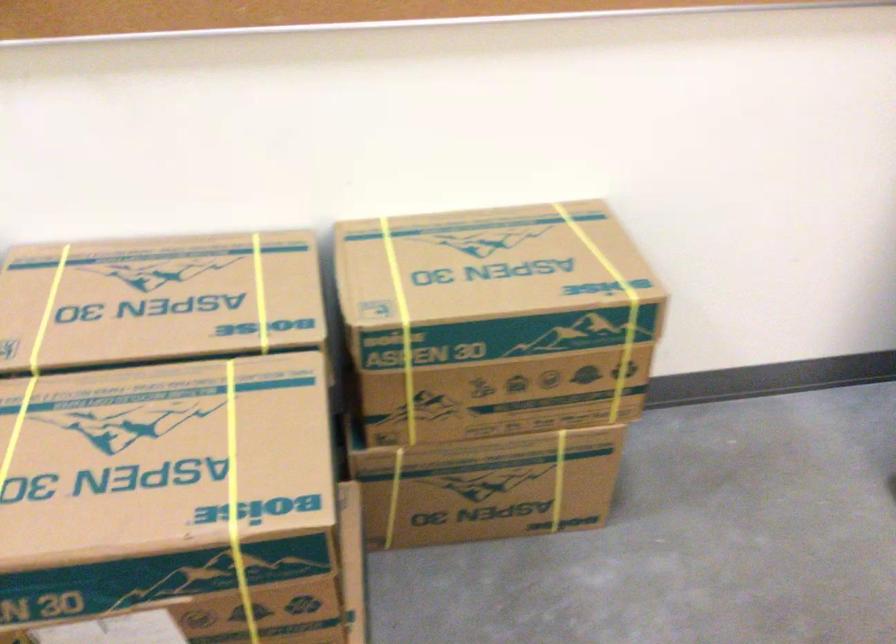
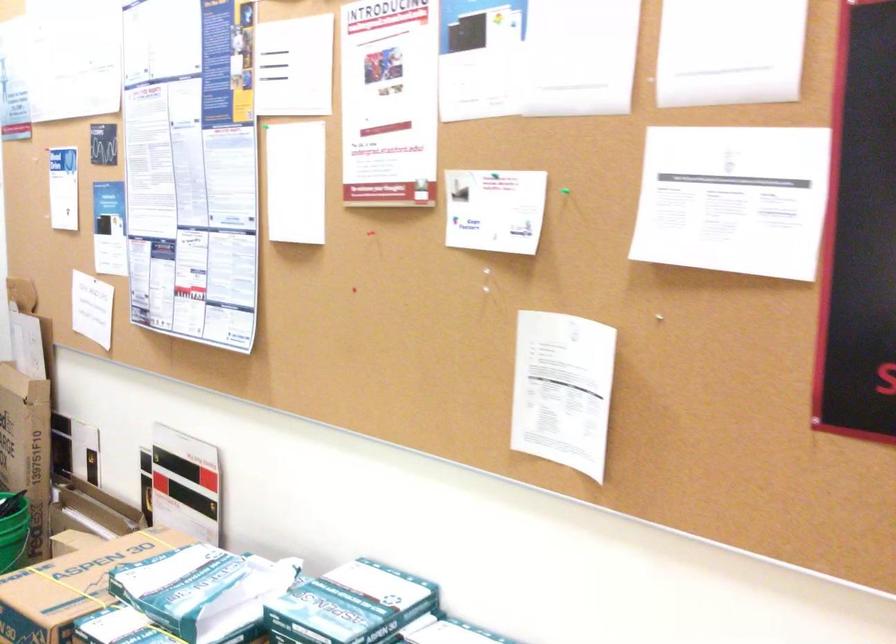
The first image is from the beginning of the video and the second image is from the end. How did the camera likely rotate when shooting the video?

The camera rotated toward left-up.